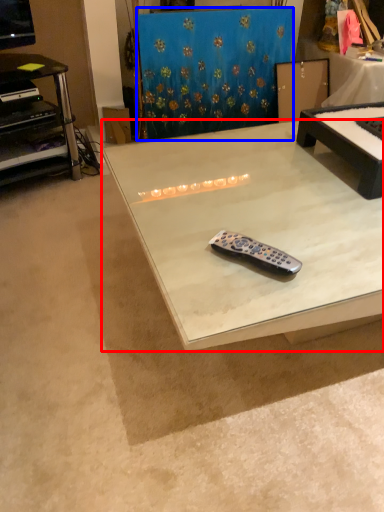
Question: Which object is closer to the camera taking this photo, table (highlighted by a red box) or curtain (highlighted by a blue box)?

Choices:
 (A) table
 (B) curtain

Answer: (A)